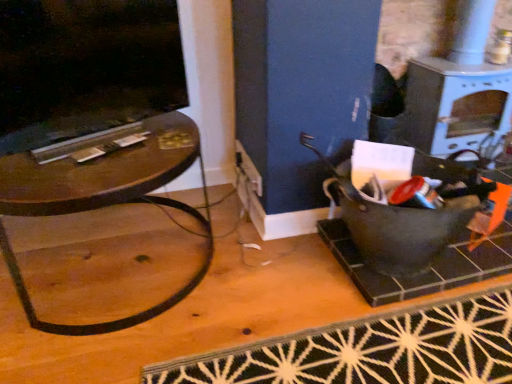
Where is `white glossy stove at upper right`? Image resolution: width=512 pixels, height=384 pixels. white glossy stove at upper right is located at coordinates (455, 105).

This screenshot has width=512, height=384. I want to click on brown wood table at left, so click(104, 198).

Describe the element at coordinates (104, 198) in the screenshot. I see `brown wood table at left` at that location.

The height and width of the screenshot is (384, 512). What are the coordinates of `white glossy stove at upper right` in the screenshot? It's located at (455, 105).

Does white glossy stove at upper right have a lesser width compared to black glossy fireplace at upper left?

In fact, white glossy stove at upper right might be wider than black glossy fireplace at upper left.

Is point (482, 108) less distant than point (116, 4)?

No, it is behind (116, 4).

Considering the sizes of white glossy stove at upper right and black glossy fireplace at upper left in the image, is white glossy stove at upper right taller or shorter than black glossy fireplace at upper left?

Considering their sizes, white glossy stove at upper right has more height than black glossy fireplace at upper left.

Considering the sizes of objects white glossy stove at upper right and brown wood table at left in the image provided, who is thinner, white glossy stove at upper right or brown wood table at left?

white glossy stove at upper right.

Considering the positions of objects white glossy stove at upper right and brown wood table at left in the image provided, who is more to the left, white glossy stove at upper right or brown wood table at left?

Positioned to the left is brown wood table at left.

From a real-world perspective, is white glossy stove at upper right physically above brown wood table at left?

Yes, from a real-world perspective, white glossy stove at upper right is on top of brown wood table at left.

Is white glossy stove at upper right inside or outside of brown wood table at left?

white glossy stove at upper right is not enclosed by brown wood table at left.

From the picture: Which object is closer to the camera taking this photo, black glossy fireplace at upper left or black woven mat at lower center?

Positioned in front is black woven mat at lower center.

From their relative heights in the image, would you say black glossy fireplace at upper left is taller or shorter than black woven mat at lower center?

In the image, black glossy fireplace at upper left appears to be taller than black woven mat at lower center.

This screenshot has width=512, height=384. What are the coordinates of `fireplace located behind the black woven mat at lower center` in the screenshot? It's located at (85, 67).

From a real-world perspective, between black glossy fireplace at upper left and brown wood table at left, who is vertically lower?

brown wood table at left, from a real-world perspective.

Based on their sizes in the image, would you say black glossy fireplace at upper left is bigger or smaller than brown wood table at left?

black glossy fireplace at upper left is smaller than brown wood table at left.

From the image's perspective, is black glossy fireplace at upper left located above or below brown wood table at left?

From the image's perspective, black glossy fireplace at upper left appears above brown wood table at left.

Are black glossy fireplace at upper left and brown wood table at left far apart?

No, black glossy fireplace at upper left is in close proximity to brown wood table at left.

Considering the points (228, 379) and (37, 206), which point is behind, point (228, 379) or point (37, 206)?

The point (228, 379) is behind.

Does black woven mat at lower center touch brown wood table at left?

black woven mat at lower center and brown wood table at left are not in contact.

Considering the relative sizes of black woven mat at lower center and brown wood table at left in the image provided, is black woven mat at lower center shorter than brown wood table at left?

Yes.

Which is more to the right, black woven mat at lower center or brown wood table at left?

Positioned to the right is black woven mat at lower center.

Is point (44, 198) in front of point (1, 150)?

Yes.

From a real-world perspective, relative to black glossy fireplace at upper left, is brown wood table at left vertically above or below?

In terms of real-world spatial position, brown wood table at left is below black glossy fireplace at upper left.

Who is more distant, brown wood table at left or black glossy fireplace at upper left?

black glossy fireplace at upper left is further from the camera.

Is brown wood table at left smaller than black glossy fireplace at upper left?

Actually, brown wood table at left might be larger than black glossy fireplace at upper left.

Consider the image. Is black glossy fireplace at upper left next to white glossy stove at upper right and touching it?

No, black glossy fireplace at upper left is not making contact with white glossy stove at upper right.

Considering the positions of objects black glossy fireplace at upper left and white glossy stove at upper right in the image provided, who is more to the left, black glossy fireplace at upper left or white glossy stove at upper right?

Positioned to the left is black glossy fireplace at upper left.

Which is in front, point (100, 2) or point (510, 103)?

The point (100, 2) is in front.

Is black glossy fireplace at upper left inside or outside of white glossy stove at upper right?

black glossy fireplace at upper left is not enclosed by white glossy stove at upper right.

I want to click on stove that appears above the black glossy fireplace at upper left (from the image's perspective), so click(455, 105).

I want to click on table located on the left of white glossy stove at upper right, so click(104, 198).

When comparing their distances from black woven mat at lower center, does white glossy stove at upper right or black glossy fireplace at upper left seem closer?

The object closer to black woven mat at lower center is white glossy stove at upper right.

Considering their positions, is white glossy stove at upper right positioned further to black woven mat at lower center than brown wood table at left?

Among the two, white glossy stove at upper right is located further to black woven mat at lower center.

Based on their spatial positions, is black glossy fireplace at upper left or black woven mat at lower center further from white glossy stove at upper right?

The object further to white glossy stove at upper right is black glossy fireplace at upper left.

Based on the photo, when comparing their distances from black glossy fireplace at upper left, does black woven mat at lower center or white glossy stove at upper right seem closer?

Among the two, black woven mat at lower center is located nearer to black glossy fireplace at upper left.

Which object lies further to the anchor point black woven mat at lower center, black glossy fireplace at upper left or brown wood table at left?

Among the two, black glossy fireplace at upper left is located further to black woven mat at lower center.

Consider the image. When comparing their distances from brown wood table at left, does black glossy fireplace at upper left or white glossy stove at upper right seem further?

Among the two, white glossy stove at upper right is located further to brown wood table at left.

When comparing their distances from white glossy stove at upper right, does black woven mat at lower center or brown wood table at left seem closer?

black woven mat at lower center lies closer to white glossy stove at upper right than the other object.

From the image, which object appears to be farther from brown wood table at left, black glossy fireplace at upper left or black woven mat at lower center?

Based on the image, black woven mat at lower center appears to be further to brown wood table at left.

Locate an element on the screen. Image resolution: width=512 pixels, height=384 pixels. doormat located between black glossy fireplace at upper left and white glossy stove at upper right in the left-right direction is located at coordinates (371, 350).

Where is `doormat between brown wood table at left and white glossy stove at upper right from left to right`? The height and width of the screenshot is (384, 512). doormat between brown wood table at left and white glossy stove at upper right from left to right is located at coordinates (371, 350).

This screenshot has height=384, width=512. Find the location of `table situated between black glossy fireplace at upper left and black woven mat at lower center from left to right`. table situated between black glossy fireplace at upper left and black woven mat at lower center from left to right is located at coordinates (104, 198).

Find the location of a particular element. This screenshot has width=512, height=384. table between black glossy fireplace at upper left and white glossy stove at upper right is located at coordinates (104, 198).